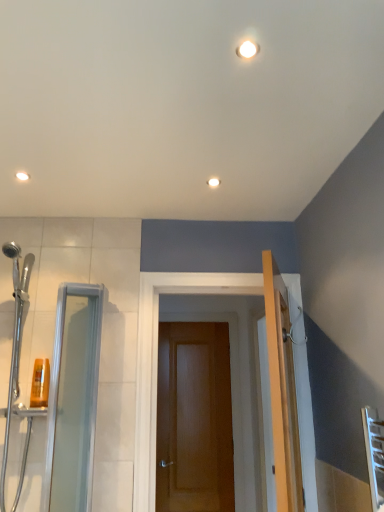
Question: Is white glossy light fixture at upper center wider than transparent glass shower door at left?

Choices:
 (A) yes
 (B) no

Answer: (B)

Question: From a real-world perspective, is white glossy light fixture at upper center located beneath transparent glass shower door at left?

Choices:
 (A) no
 (B) yes

Answer: (A)

Question: Is white glossy light fixture at upper center far away from transparent glass shower door at left?

Choices:
 (A) yes
 (B) no

Answer: (A)

Question: Considering the relative sizes of white glossy light fixture at upper center and transparent glass shower door at left in the image provided, is white glossy light fixture at upper center smaller than transparent glass shower door at left?

Choices:
 (A) yes
 (B) no

Answer: (A)

Question: Does white glossy light fixture at upper center come in front of transparent glass shower door at left?

Choices:
 (A) yes
 (B) no

Answer: (B)

Question: Does white glossy light fixture at upper center appear on the right side of transparent glass shower door at left?

Choices:
 (A) yes
 (B) no

Answer: (A)

Question: Can you confirm if translucent plastic shampoo bottle at left is smaller than white glossy light fixture at upper center?

Choices:
 (A) no
 (B) yes

Answer: (A)

Question: Can you confirm if translucent plastic shampoo bottle at left is bigger than white glossy light fixture at upper center?

Choices:
 (A) no
 (B) yes

Answer: (B)

Question: Is translucent plastic shampoo bottle at left shorter than white glossy light fixture at upper center?

Choices:
 (A) no
 (B) yes

Answer: (A)

Question: Is translucent plastic shampoo bottle at left wider than white glossy light fixture at upper center?

Choices:
 (A) no
 (B) yes

Answer: (A)

Question: Is translucent plastic shampoo bottle at left facing towards white glossy light fixture at upper center?

Choices:
 (A) no
 (B) yes

Answer: (A)

Question: Considering the relative positions of translucent plastic shampoo bottle at left and white glossy light fixture at upper center in the image provided, is translucent plastic shampoo bottle at left to the right of white glossy light fixture at upper center from the viewer's perspective?

Choices:
 (A) yes
 (B) no

Answer: (B)

Question: Considering the relative positions of transparent glass shower door at left and wooden door at center in the image provided, is transparent glass shower door at left to the left of wooden door at center from the viewer's perspective?

Choices:
 (A) no
 (B) yes

Answer: (B)